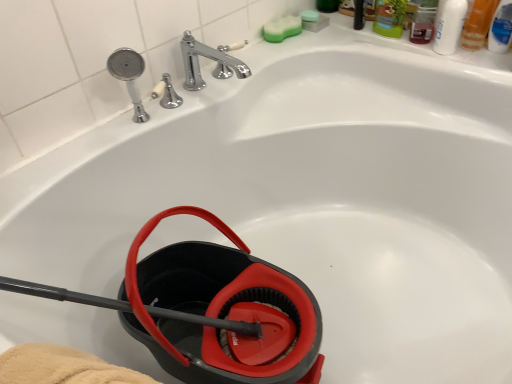
Question: Is there a large distance between translucent plastic mouthwash at upper right, which is the second mouthwash in right-to-left order, and white glossy bottle at upper right, acting as the third mouthwash starting from the right?

Choices:
 (A) yes
 (B) no

Answer: (B)

Question: Is translucent plastic mouthwash at upper right, which is the second mouthwash in right-to-left order, thinner than white glossy bottle at upper right, acting as the third mouthwash starting from the right?

Choices:
 (A) yes
 (B) no

Answer: (B)

Question: From a real-world perspective, is translucent plastic mouthwash at upper right, the second mouthwash when ordered from left to right, beneath white glossy bottle at upper right, the 1th mouthwash viewed from the left?

Choices:
 (A) yes
 (B) no

Answer: (A)

Question: Can you confirm if translucent plastic mouthwash at upper right, the second mouthwash when ordered from left to right, is taller than white glossy bottle at upper right, acting as the third mouthwash starting from the right?

Choices:
 (A) yes
 (B) no

Answer: (A)

Question: From the image's perspective, is translucent plastic mouthwash at upper right, the second mouthwash when ordered from left to right, beneath white glossy bottle at upper right, acting as the third mouthwash starting from the right?

Choices:
 (A) yes
 (B) no

Answer: (B)

Question: Is black rubber garden hose at lower left taller or shorter than green sponge at upper center, the 2th soap from the left?

Choices:
 (A) short
 (B) tall

Answer: (B)

Question: Considering the positions of black rubber garden hose at lower left and green sponge at upper center, which ranks as the 1th soap in right-to-left order, in the image, is black rubber garden hose at lower left wider or thinner than green sponge at upper center, which ranks as the 1th soap in right-to-left order,?

Choices:
 (A) thin
 (B) wide

Answer: (B)

Question: Is point (276, 367) closer or farther from the camera than point (303, 11)?

Choices:
 (A) closer
 (B) farther

Answer: (A)

Question: Relative to green sponge at upper center, the 2th soap from the left, is black rubber garden hose at lower left in front or behind?

Choices:
 (A) behind
 (B) front

Answer: (B)

Question: Is green sponge at upper right, positioned as the 1th soap in left-to-right order, bigger or smaller than blue plastic mouthwash at upper right, arranged as the first mouthwash when viewed from the right?

Choices:
 (A) big
 (B) small

Answer: (B)

Question: From a real-world perspective, is green sponge at upper right, positioned as the 1th soap in left-to-right order, positioned above or below blue plastic mouthwash at upper right, placed as the third mouthwash when sorted from left to right?

Choices:
 (A) above
 (B) below

Answer: (B)

Question: From the image's perspective, relative to blue plastic mouthwash at upper right, placed as the third mouthwash when sorted from left to right, is green sponge at upper right, which is counted as the 2th soap, starting from the right, above or below?

Choices:
 (A) above
 (B) below

Answer: (A)

Question: Is green sponge at upper right, which is counted as the 2th soap, starting from the right, inside or outside of blue plastic mouthwash at upper right, placed as the third mouthwash when sorted from left to right?

Choices:
 (A) outside
 (B) inside

Answer: (A)

Question: Based on their sizes in the image, would you say white glossy bottle at upper right, the 1th mouthwash viewed from the left, is bigger or smaller than translucent plastic mouthwash at upper right, the second mouthwash when ordered from left to right?

Choices:
 (A) big
 (B) small

Answer: (B)

Question: Do you think white glossy bottle at upper right, acting as the third mouthwash starting from the right, is within translucent plastic mouthwash at upper right, the second mouthwash when ordered from left to right, or outside of it?

Choices:
 (A) outside
 (B) inside

Answer: (A)